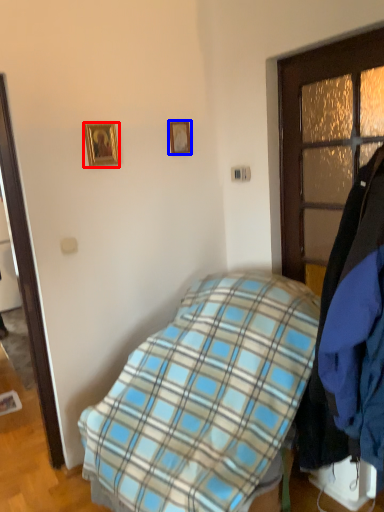
Question: Which of the following is the closest to the observer, picture frame (highlighted by a red box) or picture frame (highlighted by a blue box)?

Choices:
 (A) picture frame
 (B) picture frame

Answer: (A)